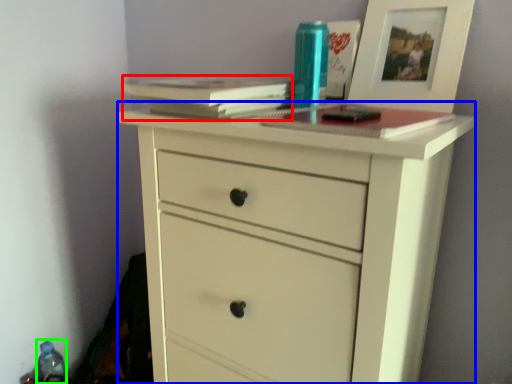
Question: Based on their relative distances, which object is nearer to paperback book (highlighted by a red box)? Choose from chest of drawers (highlighted by a blue box) and bottle (highlighted by a green box).

Choices:
 (A) chest of drawers
 (B) bottle

Answer: (A)